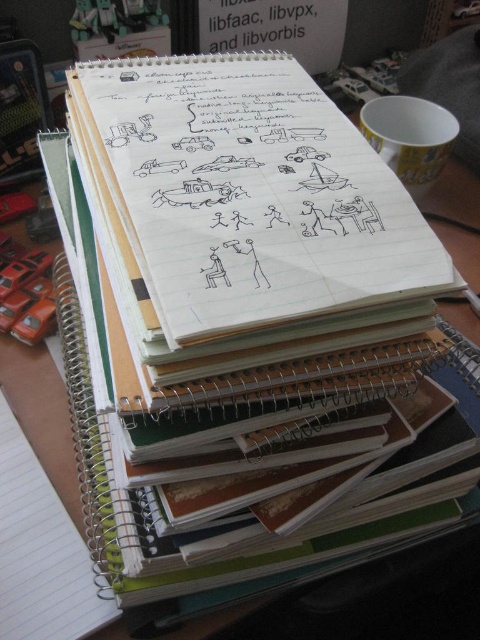
Where is the white lined paper at center located in the image?

The white lined paper at center is located at point (x=245, y=196).

You are organizing a document on the desk and need to place a new sheet between the white lined paper at center and the black paper at upper center. According to their positions, which side should you place it on?

The white lined paper at center is positioned on the left side of black paper at upper center, so you should place the new sheet to the right of the white lined paper at center and to the left of the black paper at upper center to maintain the order.